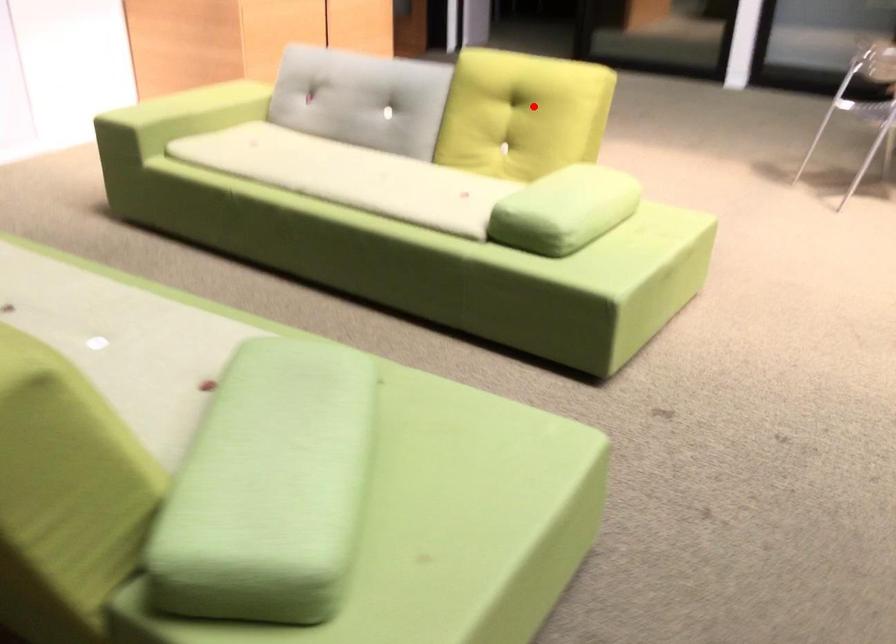
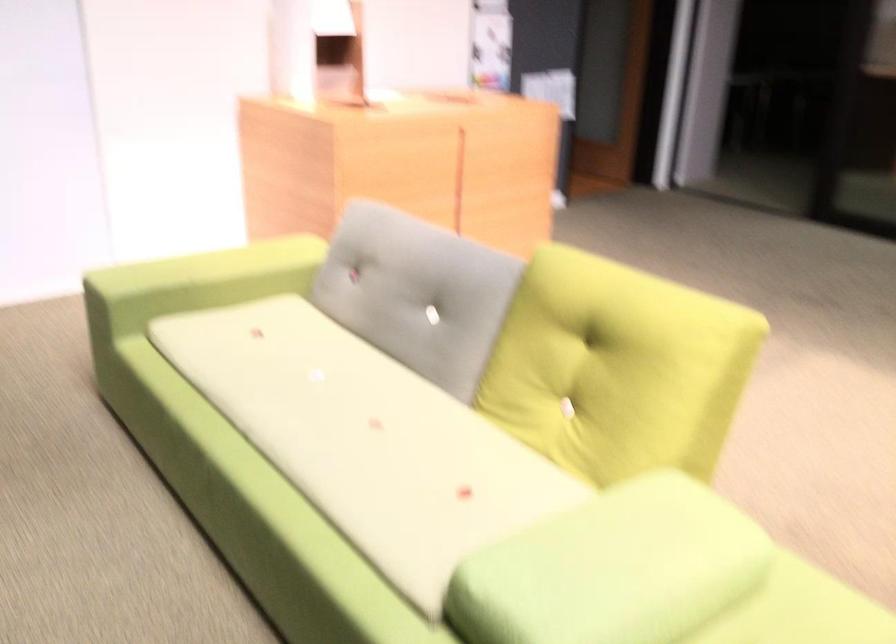
Question: I am providing you with two images of the same scene from different viewpoints. A red point is shown in image1. For the corresponding object point in image2, is it positioned nearer or farther from the camera?

Choices:
 (A) Nearer
 (B) Farther

Answer: (A)